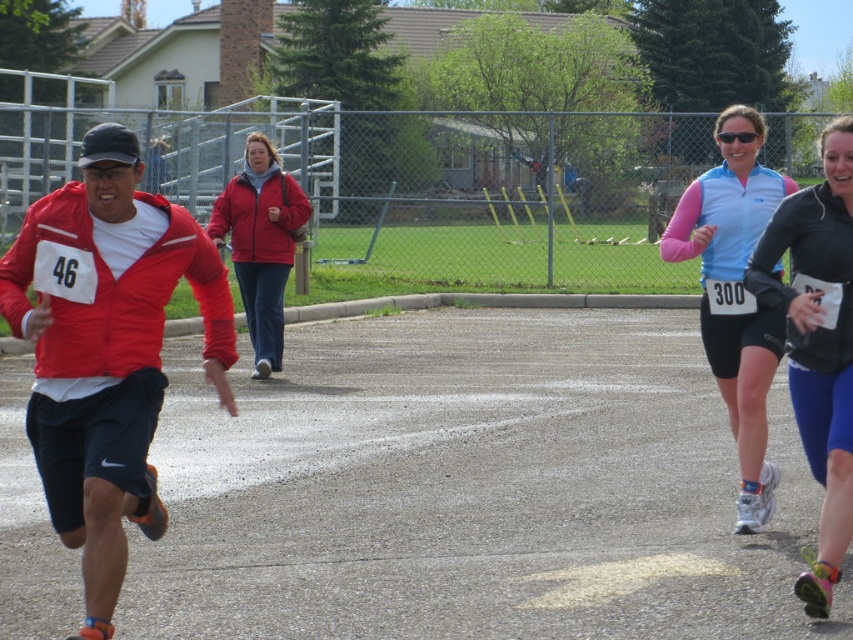
Question: Which of these objects is positioned closest to the gray asphalt road at center?

Choices:
 (A) matte red jacket at center
 (B) sunglasses at upper center
 (C) black matte running shoe at right
 (D) matte red jacket at left

Answer: (A)

Question: Which object is positioned closest to the matte red jacket at center?

Choices:
 (A) light blue synthetic vest at right
 (B) matte red jacket at left
 (C) sunglasses at upper center

Answer: (A)

Question: Can you confirm if gray asphalt road at center is smaller than black matte running shoe at right?

Choices:
 (A) yes
 (B) no

Answer: (B)

Question: Observing the image, what is the correct spatial positioning of black matte running shoe at right in reference to matte red jacket at center?

Choices:
 (A) above
 (B) below

Answer: (B)

Question: Estimate the real-world distances between objects in this image. Which object is farther from the light blue synthetic vest at right?

Choices:
 (A) black matte running shoe at right
 (B) matte red jacket at left
 (C) sunglasses at upper center
 (D) matte red jacket at center

Answer: (D)

Question: Is black matte running shoe at right smaller than sunglasses at upper center?

Choices:
 (A) yes
 (B) no

Answer: (B)